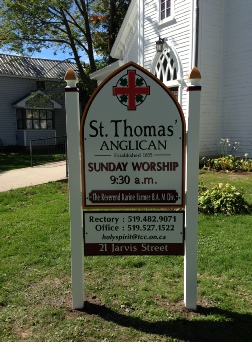
I want to click on light, so click(x=160, y=46).